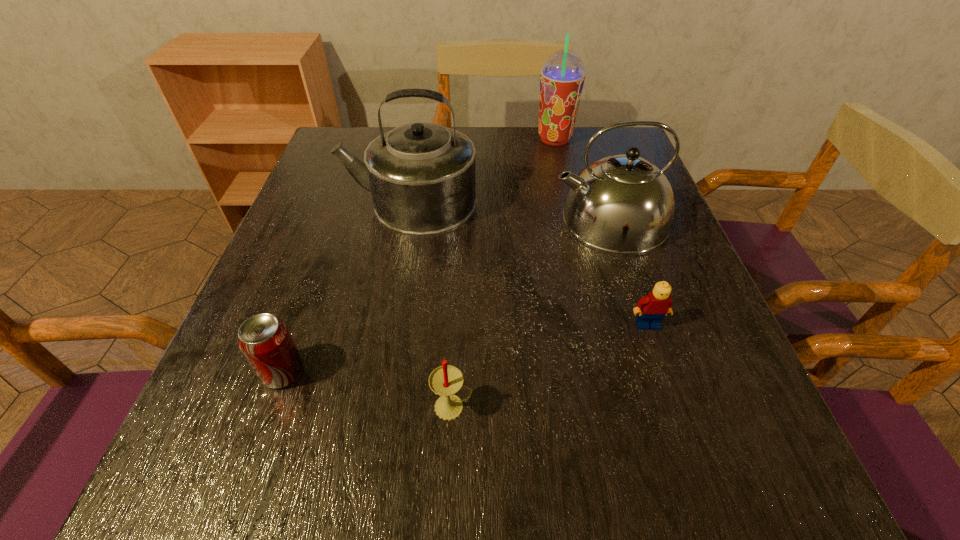
Where is `the farthest object`? the farthest object is located at coordinates (562, 77).

Where is `the left kettle`? Image resolution: width=960 pixels, height=540 pixels. the left kettle is located at coordinates point(421,175).

Locate an element on the screen. The image size is (960, 540). the right kettle is located at coordinates (623, 204).

Identify the location of the nearest object. This screenshot has width=960, height=540. pos(446,380).

Image resolution: width=960 pixels, height=540 pixels. In order to click on soda can in this screenshot , I will do `click(265, 341)`.

You are a GUI agent. You are given a task and a screenshot of the screen. Output one action in this format:
    pyautogui.click(x=<x>, y=<y>)
    Task: Click on the Lego
    
    Given the screenshot: What is the action you would take?
    pyautogui.click(x=655, y=306)

Locate an element on the screen. This screenshot has width=960, height=540. vacant space located 0.360m on the left of the farthest object is located at coordinates (403, 140).

Where is `vacant space located 0.090m with the spout at the front of the left kettle`? vacant space located 0.090m with the spout at the front of the left kettle is located at coordinates (303, 202).

The height and width of the screenshot is (540, 960). What are the coordinates of `free space located 0.080m with the spout at the front of the left kettle` in the screenshot? It's located at pyautogui.click(x=307, y=202).

The height and width of the screenshot is (540, 960). What are the coordinates of `vacant space located from the spout of the right kettle` in the screenshot? It's located at (412, 219).